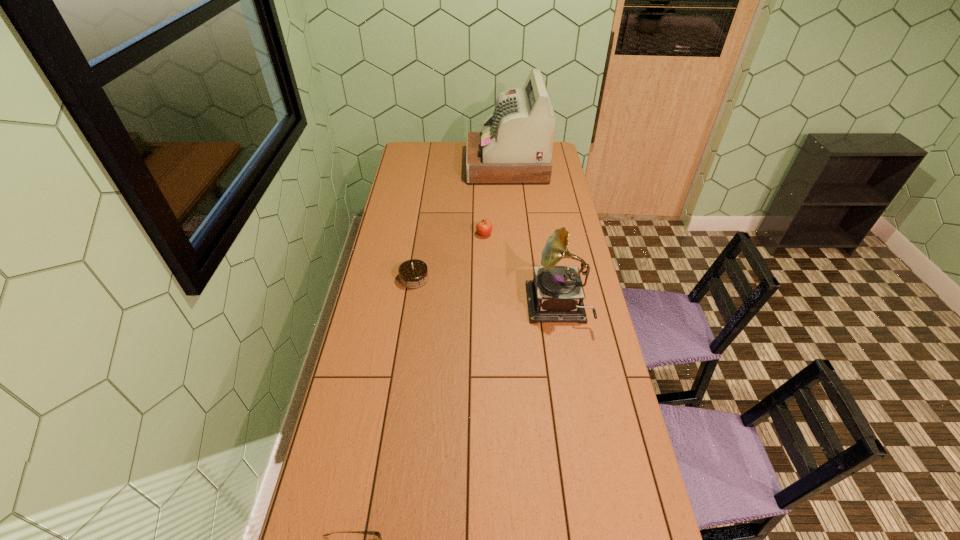
Identify the location of free point located 0.300m on the horn of the second tallest object. (451, 308).

Locate an element on the screen. free spot located on the left of the apple is located at coordinates (411, 234).

Where is `free spot located on the right of the chocolate cake`? This screenshot has width=960, height=540. free spot located on the right of the chocolate cake is located at coordinates (511, 279).

The height and width of the screenshot is (540, 960). Identify the location of object positioned at the far edge. (515, 147).

The width and height of the screenshot is (960, 540). I want to click on object situated at the left edge, so click(x=413, y=274).

Where is `cash register located at the right edge`? The image size is (960, 540). cash register located at the right edge is located at coordinates (515, 147).

Locate an element on the screen. record player present at the right edge is located at coordinates (556, 293).

The width and height of the screenshot is (960, 540). Find the location of `object at the far right corner`. object at the far right corner is located at coordinates (515, 147).

Identify the location of vacant space at the left edge of the desktop. (404, 223).

This screenshot has height=540, width=960. I want to click on free location at the right edge, so click(x=612, y=492).